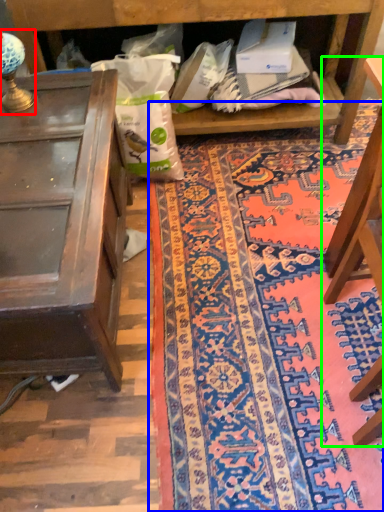
Question: Based on their relative distances, which object is nearer to lamp (highlighted by a red box)? Choose from mat (highlighted by a blue box) and furniture (highlighted by a green box).

Choices:
 (A) mat
 (B) furniture

Answer: (A)